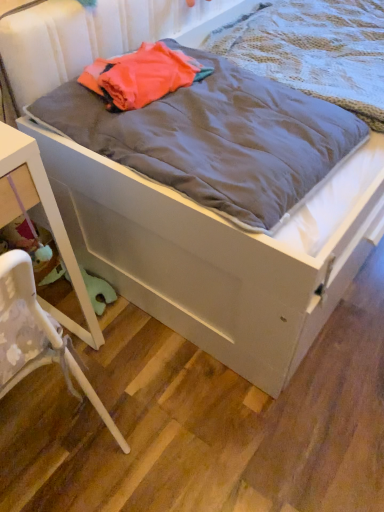
Describe the element at coordinates (38, 336) in the screenshot. Image resolution: width=384 pixels, height=512 pixels. I see `white plastic chair at lower left` at that location.

Find the location of a particular element. The height and width of the screenshot is (512, 384). gray cotton blanket at center, placed as the 2th blanket when sorted from back to front is located at coordinates (216, 139).

Is the surface of gray soft blanket at center, positioned as the first blanket in back-to-front order, in direct contact with white glossy nightstand at lower left?

No, gray soft blanket at center, positioned as the first blanket in back-to-front order, is not in contact with white glossy nightstand at lower left.

Which is more distant, (240, 31) or (6, 209)?

The point (240, 31) is behind.

From the image's perspective, is gray soft blanket at center, positioned as the first blanket in back-to-front order, located above or below white glossy nightstand at lower left?

gray soft blanket at center, positioned as the first blanket in back-to-front order, is above white glossy nightstand at lower left.

Is white plastic chair at lower left shorter than gray cotton blanket at center, acting as the first blanket starting from the front?

No, white plastic chair at lower left is not shorter than gray cotton blanket at center, acting as the first blanket starting from the front.

From a real-world perspective, is white plastic chair at lower left under gray cotton blanket at center, acting as the first blanket starting from the front?

Indeed, from a real-world perspective, white plastic chair at lower left is positioned beneath gray cotton blanket at center, acting as the first blanket starting from the front.

Locate an element on the screen. The height and width of the screenshot is (512, 384). blanket that is the 1st object located above the white plastic chair at lower left (from the image's perspective) is located at coordinates (216, 139).

Is white plastic chair at lower left to the left or to the right of gray cotton blanket at center, placed as the 2th blanket when sorted from back to front, in the image?

Based on their positions, white plastic chair at lower left is located to the left of gray cotton blanket at center, placed as the 2th blanket when sorted from back to front.

Considering the sizes of white plastic chair at lower left and white glossy nightstand at lower left in the image, is white plastic chair at lower left wider or thinner than white glossy nightstand at lower left?

Considering their sizes, white plastic chair at lower left looks broader than white glossy nightstand at lower left.

Is white plastic chair at lower left closer to camera compared to white glossy nightstand at lower left?

Yes, it is in front of white glossy nightstand at lower left.

Is white plastic chair at lower left surrounding white glossy nightstand at lower left?

Yes.

Locate an element on the screen. This screenshot has height=512, width=384. nightstand that appears behind the white plastic chair at lower left is located at coordinates click(x=45, y=218).

Can we say gray cotton blanket at center, acting as the first blanket starting from the front, lies outside gray soft blanket at center, positioned as the first blanket in back-to-front order?

Yes, gray cotton blanket at center, acting as the first blanket starting from the front, is located beyond the bounds of gray soft blanket at center, positioned as the first blanket in back-to-front order.

Which is farther from the camera, (43, 108) or (290, 29)?

Positioned behind is point (290, 29).

Where is `blanket above the gray cotton blanket at center, acting as the first blanket starting from the front (from the image's perspective)`? This screenshot has height=512, width=384. blanket above the gray cotton blanket at center, acting as the first blanket starting from the front (from the image's perspective) is located at coordinates (314, 50).

From the image's perspective, which one is positioned higher, gray cotton blanket at center, placed as the 2th blanket when sorted from back to front, or gray soft blanket at center, positioned as the 2th blanket in front-to-back order?

gray soft blanket at center, positioned as the 2th blanket in front-to-back order, appears higher in the image.

Is white glossy nightstand at lower left oriented away from gray cotton blanket at center, acting as the first blanket starting from the front?

No, white glossy nightstand at lower left's orientation is not away from gray cotton blanket at center, acting as the first blanket starting from the front.

Is gray cotton blanket at center, placed as the 2th blanket when sorted from back to front, completely or partially inside white glossy nightstand at lower left?

No, gray cotton blanket at center, placed as the 2th blanket when sorted from back to front, is located outside of white glossy nightstand at lower left.

How much distance is there between white glossy nightstand at lower left and gray cotton blanket at center, acting as the first blanket starting from the front?

white glossy nightstand at lower left is 16.98 inches away from gray cotton blanket at center, acting as the first blanket starting from the front.

In terms of size, does white glossy nightstand at lower left appear bigger or smaller than gray cotton blanket at center, placed as the 2th blanket when sorted from back to front?

Clearly, white glossy nightstand at lower left is larger in size than gray cotton blanket at center, placed as the 2th blanket when sorted from back to front.

In the scene shown: Is white plastic chair at lower left oriented away from gray soft blanket at center, positioned as the first blanket in back-to-front order?

white plastic chair at lower left does not have its back to gray soft blanket at center, positioned as the first blanket in back-to-front order.

Considering the relative positions of white plastic chair at lower left and gray soft blanket at center, positioned as the first blanket in back-to-front order, in the image provided, is white plastic chair at lower left to the left or to the right of gray soft blanket at center, positioned as the first blanket in back-to-front order,?

In the image, white plastic chair at lower left appears on the left side of gray soft blanket at center, positioned as the first blanket in back-to-front order.

Would you say gray soft blanket at center, positioned as the 2th blanket in front-to-back order, is part of white plastic chair at lower left's contents?

Actually, gray soft blanket at center, positioned as the 2th blanket in front-to-back order, is outside white plastic chair at lower left.

From the image's perspective, does white plastic chair at lower left appear lower than gray soft blanket at center, positioned as the 2th blanket in front-to-back order?

Indeed, from the image's perspective, white plastic chair at lower left is shown beneath gray soft blanket at center, positioned as the 2th blanket in front-to-back order.

Who is bigger, gray soft blanket at center, positioned as the first blanket in back-to-front order, or white plastic chair at lower left?

Bigger between the two is white plastic chair at lower left.

Is gray soft blanket at center, positioned as the 2th blanket in front-to-back order, spatially inside white plastic chair at lower left, or outside of it?

gray soft blanket at center, positioned as the 2th blanket in front-to-back order, is not inside white plastic chair at lower left, it's outside.

Which blanket is the 2nd one when counting from the back of the white glossy nightstand at lower left? Please provide its 2D coordinates.

[(314, 50)]

This screenshot has width=384, height=512. I want to click on chair located below the gray cotton blanket at center, acting as the first blanket starting from the front (from the image's perspective), so click(38, 336).

Considering their positions, is white plastic chair at lower left positioned closer to gray soft blanket at center, positioned as the first blanket in back-to-front order, than gray cotton blanket at center, placed as the 2th blanket when sorted from back to front?

Based on the image, gray cotton blanket at center, placed as the 2th blanket when sorted from back to front, appears to be nearer to gray soft blanket at center, positioned as the first blanket in back-to-front order.

Estimate the real-world distances between objects in this image. Which object is closer to gray cotton blanket at center, placed as the 2th blanket when sorted from back to front, white plastic chair at lower left or white glossy nightstand at lower left?

white glossy nightstand at lower left lies closer to gray cotton blanket at center, placed as the 2th blanket when sorted from back to front, than the other object.

From the image, which object appears to be nearer to white plastic chair at lower left, white glossy nightstand at lower left or gray soft blanket at center, positioned as the first blanket in back-to-front order?

Among the two, white glossy nightstand at lower left is located nearer to white plastic chair at lower left.

Estimate the real-world distances between objects in this image. Which object is closer to white glossy nightstand at lower left, gray soft blanket at center, positioned as the 2th blanket in front-to-back order, or gray cotton blanket at center, placed as the 2th blanket when sorted from back to front?

gray cotton blanket at center, placed as the 2th blanket when sorted from back to front, lies closer to white glossy nightstand at lower left than the other object.

From the image, which object appears to be nearer to white glossy nightstand at lower left, white plastic chair at lower left or gray soft blanket at center, positioned as the 2th blanket in front-to-back order?

white plastic chair at lower left.

Looking at the image, which one is located closer to gray soft blanket at center, positioned as the first blanket in back-to-front order, white glossy nightstand at lower left or white plastic chair at lower left?

Based on the image, white glossy nightstand at lower left appears to be nearer to gray soft blanket at center, positioned as the first blanket in back-to-front order.

Which object lies further to the anchor point gray cotton blanket at center, placed as the 2th blanket when sorted from back to front, white glossy nightstand at lower left or white plastic chair at lower left?

Among the two, white plastic chair at lower left is located further to gray cotton blanket at center, placed as the 2th blanket when sorted from back to front.

Considering their positions, is gray cotton blanket at center, acting as the first blanket starting from the front, positioned closer to gray soft blanket at center, positioned as the first blanket in back-to-front order, than white glossy nightstand at lower left?

Based on the image, gray cotton blanket at center, acting as the first blanket starting from the front, appears to be nearer to gray soft blanket at center, positioned as the first blanket in back-to-front order.

At what (x,y) coordinates should I click in order to perform the action: click on chair between white glossy nightstand at lower left and gray soft blanket at center, positioned as the first blanket in back-to-front order, from left to right. Please return your answer as a coordinate pair (x, y). This screenshot has width=384, height=512. Looking at the image, I should click on (38, 336).

Where is `chair between white glossy nightstand at lower left and gray cotton blanket at center, acting as the first blanket starting from the front, in the horizontal direction`? The width and height of the screenshot is (384, 512). chair between white glossy nightstand at lower left and gray cotton blanket at center, acting as the first blanket starting from the front, in the horizontal direction is located at coordinates (38, 336).

Find the location of a particular element. blanket between white glossy nightstand at lower left and gray soft blanket at center, positioned as the first blanket in back-to-front order, in the horizontal direction is located at coordinates (216, 139).

At what (x,y) coordinates should I click in order to perform the action: click on blanket between gray soft blanket at center, positioned as the 2th blanket in front-to-back order, and white plastic chair at lower left from top to bottom. Please return your answer as a coordinate pair (x, y). The width and height of the screenshot is (384, 512). Looking at the image, I should click on (216, 139).